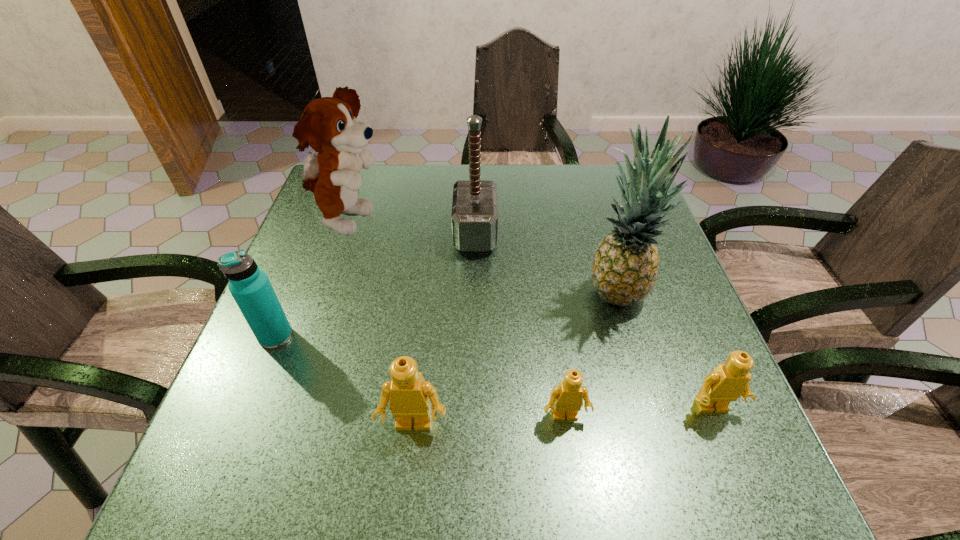
Locate an element on the screen. blank space located on the face of the puppy is located at coordinates 424,222.

Where is `vacant area situated on the back of the hammer`? This screenshot has height=540, width=960. vacant area situated on the back of the hammer is located at coordinates (476, 176).

The image size is (960, 540). I want to click on vacant region located on the right of the water bottle, so click(317, 336).

This screenshot has height=540, width=960. I want to click on free region located 0.260m on the front of the fifth nearest object, so click(657, 435).

Locate an element on the screen. The height and width of the screenshot is (540, 960). object positioned at the far edge is located at coordinates (329, 125).

The width and height of the screenshot is (960, 540). What are the coordinates of `puppy that is at the left edge` in the screenshot? It's located at (329, 125).

What are the coordinates of `water bottle that is at the left edge` in the screenshot? It's located at (250, 286).

Locate an element on the screen. Lego that is positioned at the right edge is located at coordinates pos(727,382).

Identify the location of pineapple at the right edge. (625, 267).

Find the location of a particular element. The image size is (960, 540). object at the far left corner is located at coordinates (329, 125).